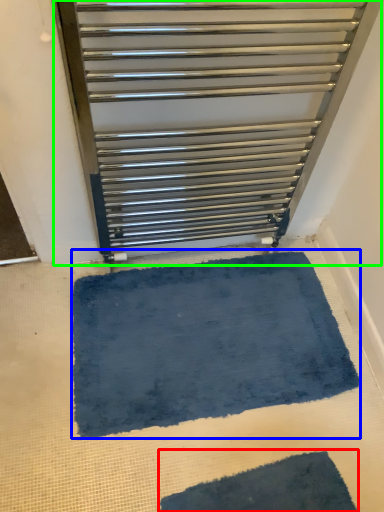
Question: Which is nearer to the bath mat (highlighted by a red box)? bath mat (highlighted by a blue box) or furniture (highlighted by a green box).

Choices:
 (A) bath mat
 (B) furniture

Answer: (A)